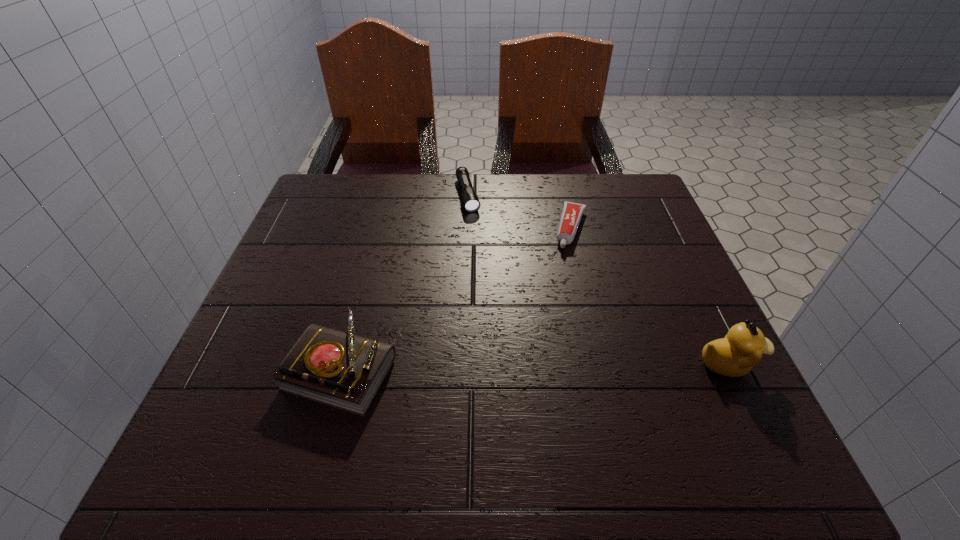
Locate an element on the screen. The image size is (960, 540). free space located 0.100m at the nozzle of the toothpaste is located at coordinates (564, 280).

The height and width of the screenshot is (540, 960). Find the location of `blank space located at the lens end of the second object from left to right`. blank space located at the lens end of the second object from left to right is located at coordinates (494, 296).

Identify the location of free location located at the lens end of the second object from left to right. (484, 262).

Identify the location of free space located 0.150m at the lens end of the second object from left to right. The width and height of the screenshot is (960, 540). (481, 251).

Where is `toothpaste at the far edge`? The width and height of the screenshot is (960, 540). toothpaste at the far edge is located at coordinates (572, 212).

Find the location of a particular element. The width and height of the screenshot is (960, 540). flashlight at the far edge is located at coordinates 470,200.

In order to click on diary located in the near edge section of the desktop in this screenshot , I will do `click(342, 370)`.

The image size is (960, 540). Identify the location of duckling that is at the near edge. (734, 355).

At what (x,y) coordinates should I click in order to perform the action: click on object present at the left edge. Please return your answer as a coordinate pair (x, y). Looking at the image, I should click on pos(342,370).

At what (x,y) coordinates should I click in order to perform the action: click on object at the right edge. Please return your answer as a coordinate pair (x, y). Image resolution: width=960 pixels, height=540 pixels. Looking at the image, I should click on (734, 355).